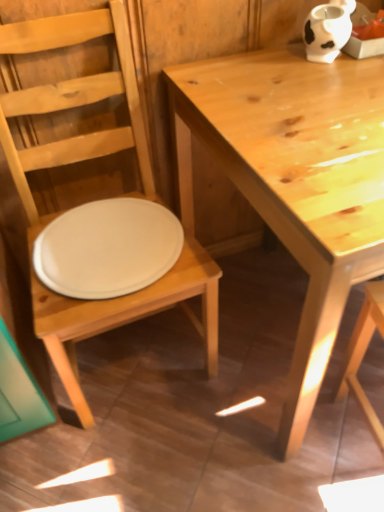
Question: Is white matte plate at center outside of white matte cow-shaped vase at upper right?

Choices:
 (A) no
 (B) yes

Answer: (B)

Question: Is white matte plate at center behind white matte cow-shaped vase at upper right?

Choices:
 (A) yes
 (B) no

Answer: (B)

Question: Would you say white matte plate at center contains white matte cow-shaped vase at upper right?

Choices:
 (A) yes
 (B) no

Answer: (B)

Question: From the image's perspective, is white matte plate at center located above white matte cow-shaped vase at upper right?

Choices:
 (A) yes
 (B) no

Answer: (B)

Question: From the image's perspective, is white matte plate at center located beneath white matte cow-shaped vase at upper right?

Choices:
 (A) yes
 (B) no

Answer: (A)

Question: Based on their sizes in the image, would you say light brown wooden table at center is bigger or smaller than matte white plate at left?

Choices:
 (A) small
 (B) big

Answer: (B)

Question: From the image's perspective, is light brown wooden table at center located above or below matte white plate at left?

Choices:
 (A) above
 (B) below

Answer: (A)

Question: Visually, is light brown wooden table at center positioned to the left or to the right of matte white plate at left?

Choices:
 (A) left
 (B) right

Answer: (B)

Question: Considering the positions of light brown wooden table at center and matte white plate at left in the image, is light brown wooden table at center wider or thinner than matte white plate at left?

Choices:
 (A) thin
 (B) wide

Answer: (B)

Question: Choose the correct answer: Is white matte cow-shaped vase at upper right inside white matte plate at center or outside it?

Choices:
 (A) inside
 (B) outside

Answer: (B)

Question: Is point (304, 20) closer or farther from the camera than point (74, 287)?

Choices:
 (A) closer
 (B) farther

Answer: (B)

Question: Is white matte cow-shaped vase at upper right taller or shorter than white matte plate at center?

Choices:
 (A) tall
 (B) short

Answer: (A)

Question: Relative to white matte plate at center, is white matte cow-shaped vase at upper right in front or behind?

Choices:
 (A) behind
 (B) front

Answer: (A)

Question: Considering the positions of white matte plate at center and white matte cow-shaped vase at upper right in the image, is white matte plate at center taller or shorter than white matte cow-shaped vase at upper right?

Choices:
 (A) tall
 (B) short

Answer: (B)

Question: From a real-world perspective, relative to white matte cow-shaped vase at upper right, is white matte plate at center vertically above or below?

Choices:
 (A) below
 (B) above

Answer: (A)